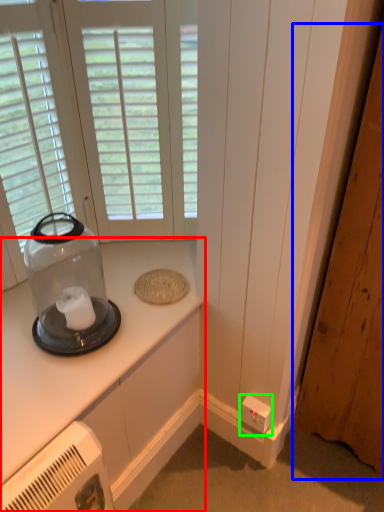
Question: Based on their relative distances, which object is nearer to countertop (highlighted by a red box)? Choose from door (highlighted by a blue box) and electric outlet (highlighted by a green box).

Choices:
 (A) door
 (B) electric outlet

Answer: (B)